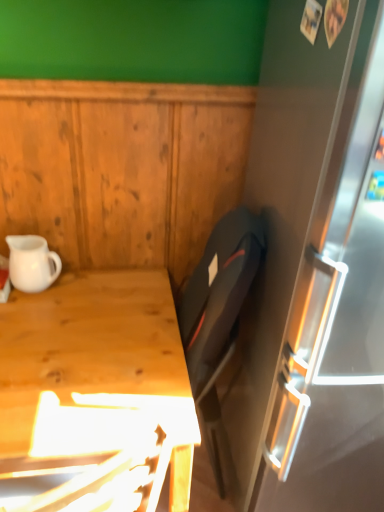
Question: Considering their positions, is light wood desk at lower left located in front of or behind white matte pitcher at left?

Choices:
 (A) front
 (B) behind

Answer: (A)

Question: Looking at the image, does light wood desk at lower left seem bigger or smaller compared to white matte pitcher at left?

Choices:
 (A) small
 (B) big

Answer: (B)

Question: Is point (107, 368) closer or farther from the camera than point (36, 252)?

Choices:
 (A) farther
 (B) closer

Answer: (B)

Question: Is white matte pitcher at left wider or thinner than light wood desk at lower left?

Choices:
 (A) wide
 (B) thin

Answer: (B)

Question: From the image's perspective, relative to light wood desk at lower left, is white matte pitcher at left above or below?

Choices:
 (A) above
 (B) below

Answer: (A)

Question: In the image, is white matte pitcher at left positioned in front of or behind light wood desk at lower left?

Choices:
 (A) front
 (B) behind

Answer: (B)

Question: Based on their positions, is white matte pitcher at left located to the left or right of light wood desk at lower left?

Choices:
 (A) right
 (B) left

Answer: (B)